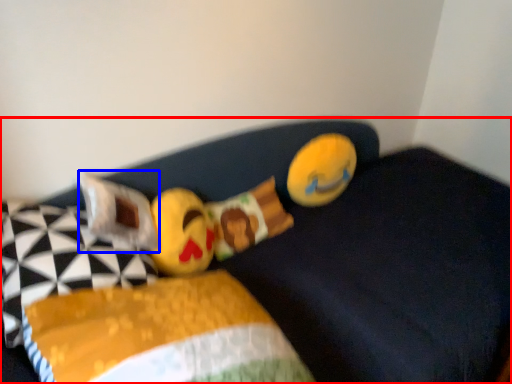
Question: Which object appears closest to the camera in this image, furniture (highlighted by a red box) or pillow (highlighted by a blue box)?

Choices:
 (A) furniture
 (B) pillow

Answer: (A)